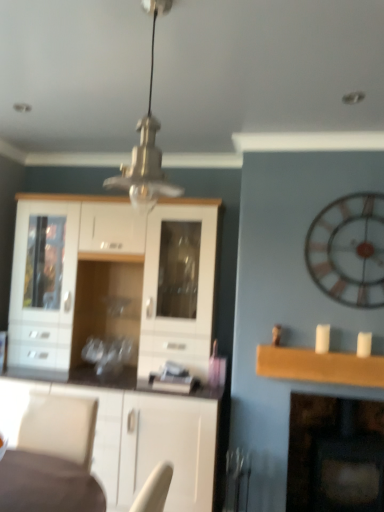
Question: Does point (324, 438) appear closer or farther from the camera than point (157, 12)?

Choices:
 (A) farther
 (B) closer

Answer: (A)

Question: Based on their sizes in the image, would you say dark brown wood fireplace at lower right is bigger or smaller than metallic glass pendant light at center?

Choices:
 (A) big
 (B) small

Answer: (A)

Question: Based on their relative distances, which object is farther from the dark brown wood fireplace at lower right?

Choices:
 (A) metallic glass pendant light at center
 (B) white glossy cabinet at center
 (C) wooden clock at right

Answer: (A)

Question: Which is nearer to the dark brown wood fireplace at lower right?

Choices:
 (A) metallic glass pendant light at center
 (B) wooden clock at right
 (C) white glossy cabinet at center

Answer: (B)